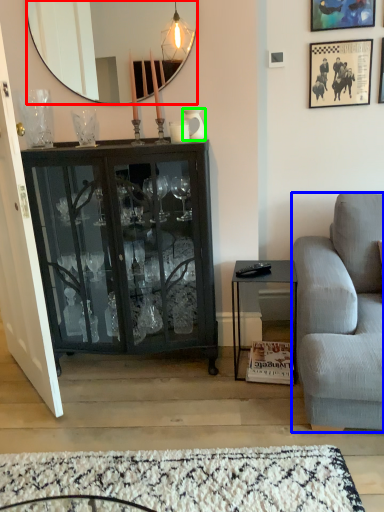
Question: Which object is positioned farthest from mirror (highlighted by a red box)? Select from studio couch (highlighted by a blue box) and vase (highlighted by a green box).

Choices:
 (A) studio couch
 (B) vase

Answer: (A)